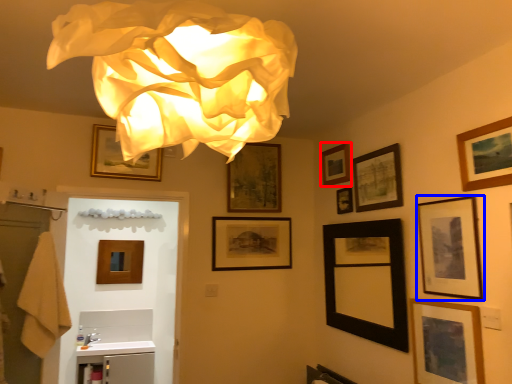
Question: Which object appears closest to the camera in this image, picture frame (highlighted by a red box) or picture frame (highlighted by a blue box)?

Choices:
 (A) picture frame
 (B) picture frame

Answer: (B)